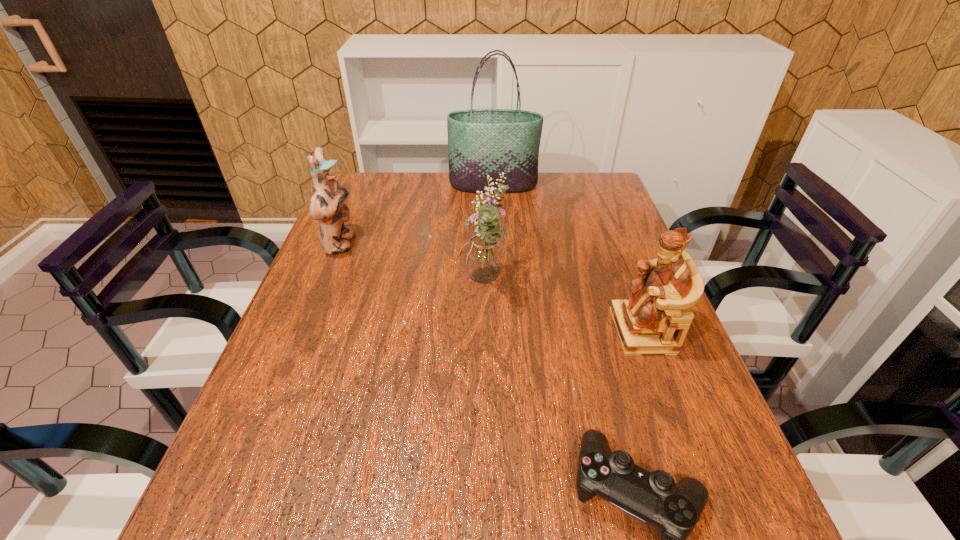
I want to click on vacant area situated on the front-facing side of the leftmost object, so click(426, 244).

Locate an element on the screen. Image resolution: width=960 pixels, height=540 pixels. vacant area situated 0.400m on the front-facing side of the right figurine is located at coordinates (440, 330).

Find the location of a particular element. This screenshot has height=540, width=960. free space located on the front-facing side of the right figurine is located at coordinates (474, 330).

Find the location of a particular element. The image size is (960, 540). vacant space positioned on the front-facing side of the right figurine is located at coordinates (523, 330).

I want to click on object situated at the far edge, so click(x=481, y=142).

This screenshot has height=540, width=960. Find the location of `object positioned at the left edge`. object positioned at the left edge is located at coordinates (327, 205).

Find the location of a particular element. This screenshot has height=540, width=960. object situated at the right edge is located at coordinates (655, 319).

Find the location of a particular element. Image resolution: width=960 pixels, height=540 pixels. vacant area at the far edge is located at coordinates (422, 203).

At what (x,y) coordinates should I click in order to perform the action: click on free space at the near edge of the desktop. Please return your answer as a coordinate pair (x, y). Looking at the image, I should click on (453, 505).

You are a GUI agent. You are given a task and a screenshot of the screen. Output one action in this format:
    pyautogui.click(x=<x>, y=<y>)
    Task: Click on the vacant space at the left edge of the desktop
    
    Given the screenshot: What is the action you would take?
    pyautogui.click(x=385, y=215)